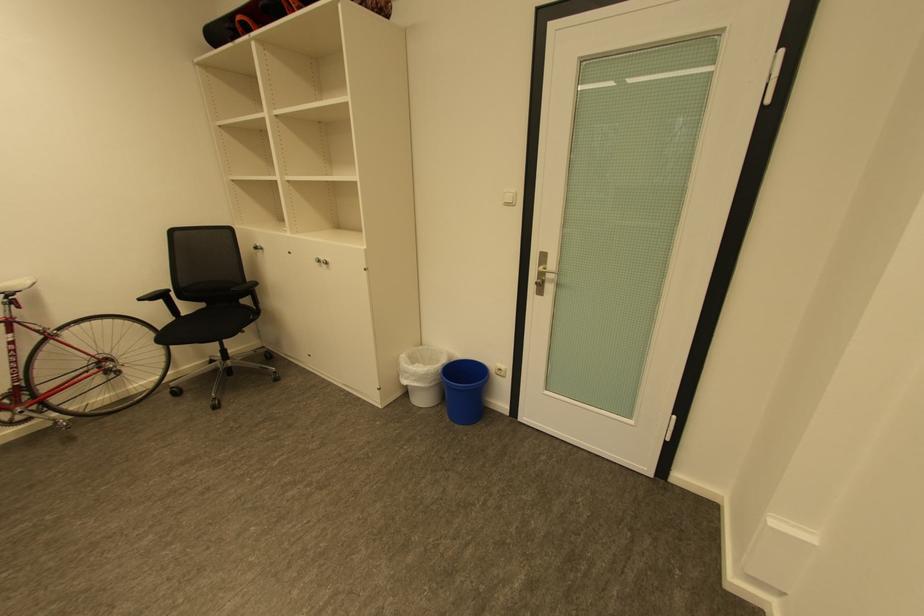
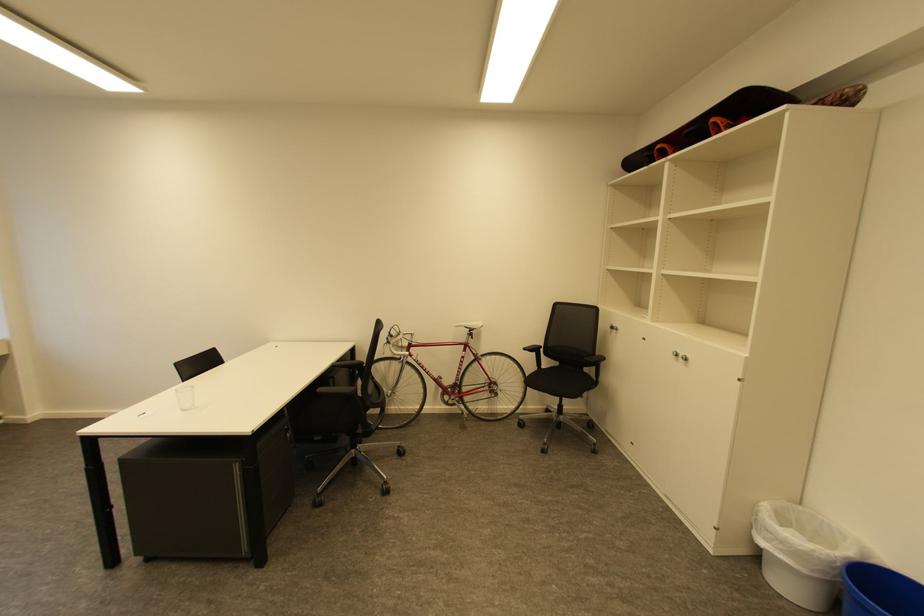
Where in the second image is the point corresponding to [238,290] from the first image?

(591, 360)